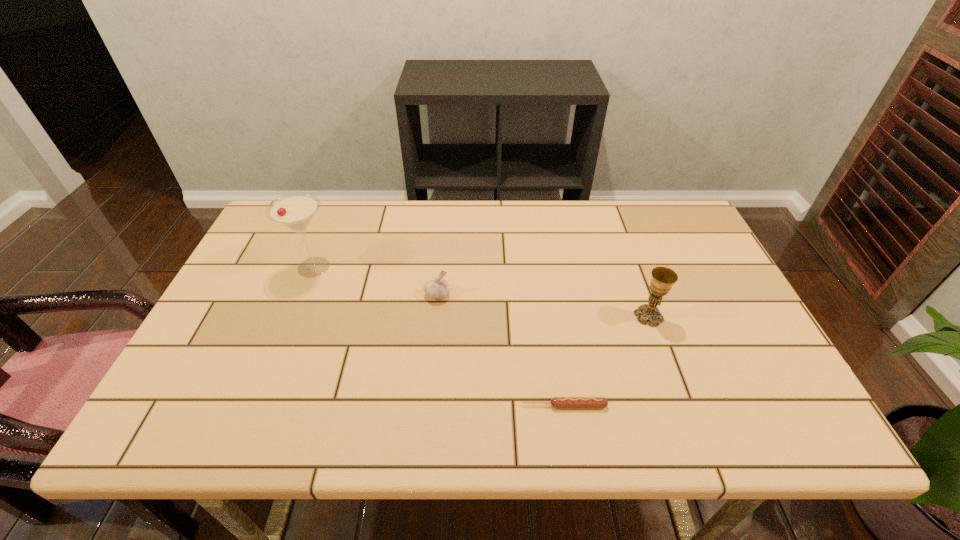
You are a GUI agent. You are given a task and a screenshot of the screen. Output one action in this format:
    pyautogui.click(x=<x>, y=<y>)
    Task: Click on the martini
    This screenshot has width=960, height=540.
    Given the screenshot: What is the action you would take?
    pyautogui.click(x=295, y=211)

The width and height of the screenshot is (960, 540). Identify the location of the tallest object. (295, 211).

The image size is (960, 540). I want to click on the second nearest object, so click(x=662, y=278).

Locate an element on the screen. The width and height of the screenshot is (960, 540). the third shortest object is located at coordinates (662, 278).

Locate an element on the screen. Image resolution: width=960 pixels, height=540 pixels. the second shortest object is located at coordinates pos(436,289).

Locate an element on the screen. Image resolution: width=960 pixels, height=540 pixels. the second object from left to right is located at coordinates (436, 289).

You are a GUI agent. You are given a task and a screenshot of the screen. Output one action in this format:
    pyautogui.click(x=<x>, y=<y>)
    Task: Click on the third object from left to right
    The height and width of the screenshot is (540, 960).
    Given the screenshot: What is the action you would take?
    pyautogui.click(x=556, y=402)

Where is `the shortest object`? This screenshot has width=960, height=540. the shortest object is located at coordinates (556, 402).

Locate an element on the screen. free region located 0.240m on the back of the martini is located at coordinates (339, 205).

This screenshot has height=540, width=960. I want to click on vacant space located on the back of the rightmost object, so click(x=638, y=288).